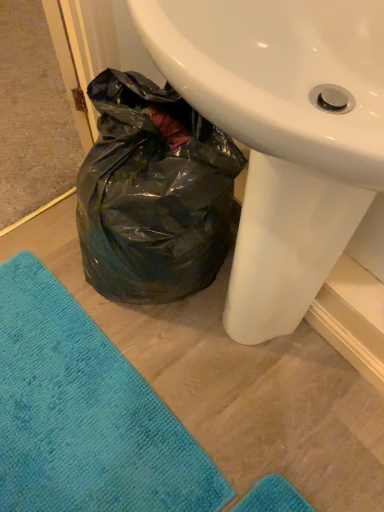
Question: From the image's perspective, is white glossy sink at center located above or below teal soft towel at lower left?

Choices:
 (A) above
 (B) below

Answer: (A)

Question: Considering the positions of white glossy sink at center and teal soft towel at lower left in the image, is white glossy sink at center bigger or smaller than teal soft towel at lower left?

Choices:
 (A) small
 (B) big

Answer: (B)

Question: Considering the positions of white glossy sink at center and teal soft towel at lower left in the image, is white glossy sink at center wider or thinner than teal soft towel at lower left?

Choices:
 (A) thin
 (B) wide

Answer: (A)

Question: From the image's perspective, is teal soft towel at lower left positioned above or below white glossy sink at center?

Choices:
 (A) below
 (B) above

Answer: (A)

Question: Is teal soft towel at lower left taller or shorter than white glossy sink at center?

Choices:
 (A) tall
 (B) short

Answer: (B)

Question: Based on their sizes in the image, would you say teal soft towel at lower left is bigger or smaller than white glossy sink at center?

Choices:
 (A) small
 (B) big

Answer: (A)

Question: Is teal soft towel at lower left in front of or behind white glossy sink at center in the image?

Choices:
 (A) behind
 (B) front

Answer: (A)